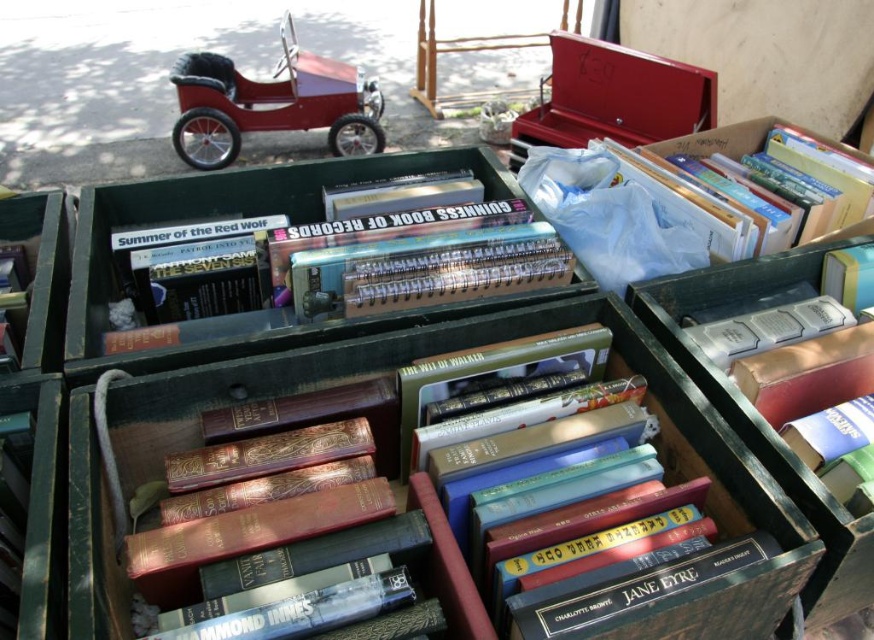
You are standing in front of the crates of books and want to pick up an object. There are two points marked in the image, point 1 at coordinates point (216, 152) and point 2 at coordinates point (725, 218). Which point is closer to you?

Point (216, 152) is closer to you because it is further to the camera than point (725, 218).

You are a child trying to reach both the shiny red toy car at upper left and the white plastic bag at upper right. Which object is closer to you?

The shiny red toy car at upper left is closer to you because it is further to the viewer than the white plastic bag at upper right.